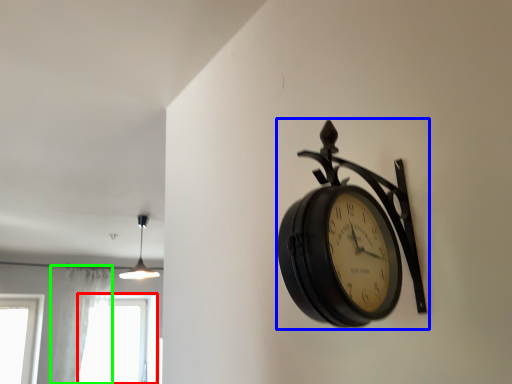
Question: Which object is the farthest from window (highlighted by a red box)? Choose among these: wall clock (highlighted by a blue box) or curtain (highlighted by a green box).

Choices:
 (A) wall clock
 (B) curtain

Answer: (A)